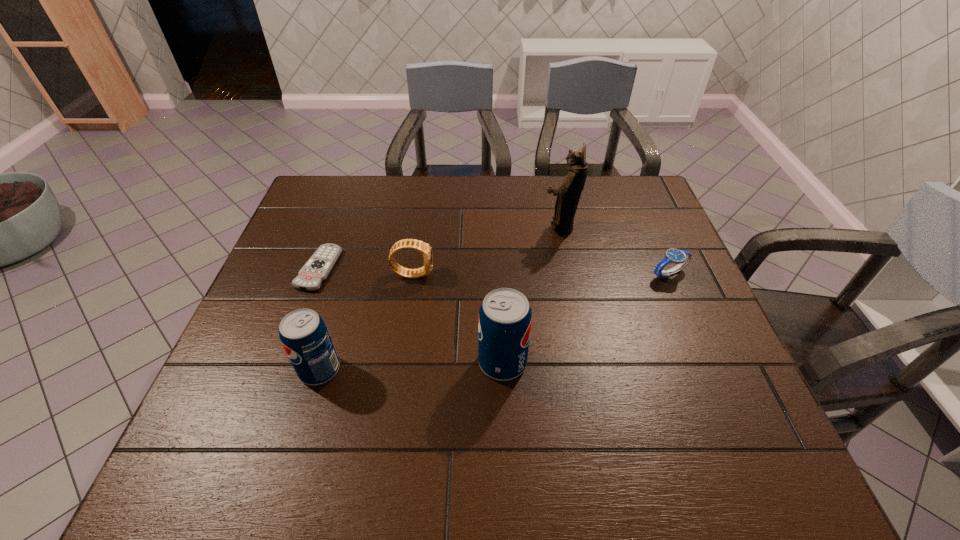
Observe the arrangement of all pops in the image. To keep them evenly spaced, where would you place another pop on the right? Please locate a free space. Please provide its 2D coordinates. Your answer should be formatted as a tuple, i.e. [(x, y)], where the tuple contains the x and y coordinates of a point satisfying the conditions above.

[(681, 355)]